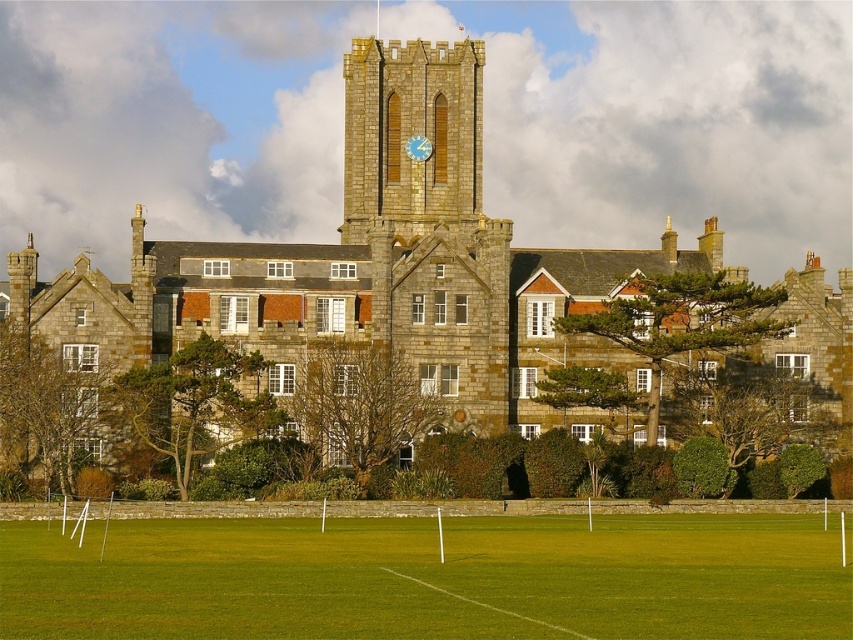
You are a visitor at the historic building and want to take a photo of the blue wooden clock at center while standing on the green grass football field at lower center. Is the clock visible from that position?

The green grass football field at lower center is located below the blue wooden clock at center, so the clock should be visible from the field as it is positioned above.

You are standing in front of the brown stone church at center and the stone clock tower at center. Which one do you see as taller?

The brown stone church at center is taller than the stone clock tower at center.